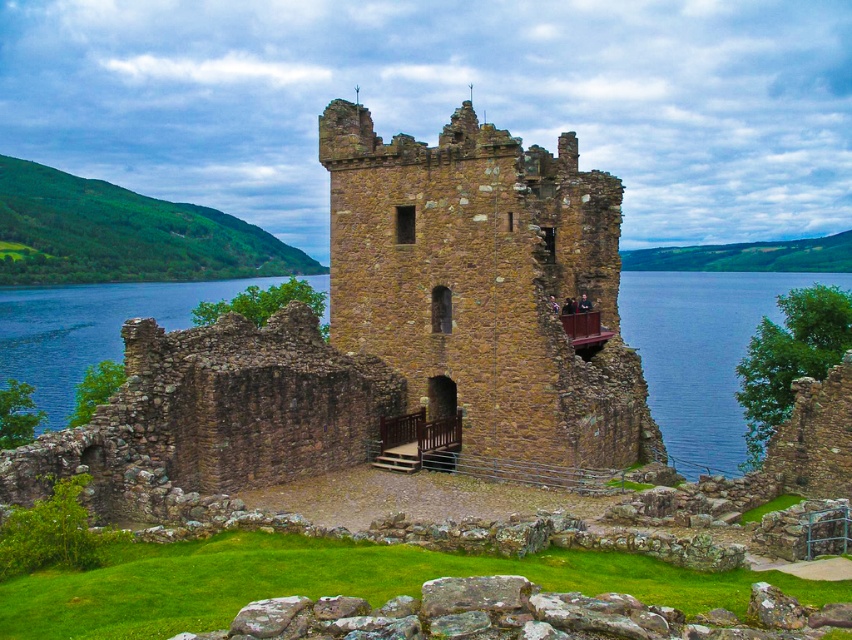
What is the color and material of the object located at the coordinates point (701, 353) in the image of Urquhart Castle?

The object at point (701, 353) is brown stone water at center.

You are a visitor standing at the entrance of the brown stone castle at center and want to reach the brown stone tower at center. Which direction should you move to get closer to the tower?

The brown stone tower at center is part of the brown stone castle at center, so you are already at the tower. No need to move.

You are a tourist visiting Urquhart Castle and want to take a photo of both the brown stone water at center and the blue water at lower right. Which one should you focus on first if you want to capture the wider body of water in your shot?

The brown stone water at center is wider than the blue water at lower right, so you should focus on the brown stone water at center first to capture the wider body of water.